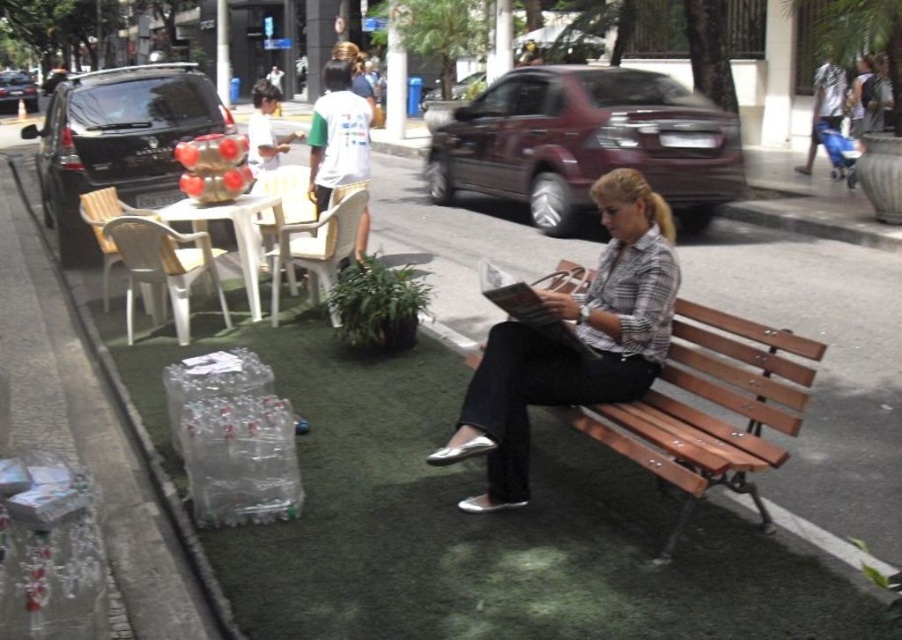
Question: Is plaid fabric shirt at center smaller than wooden bench at center?

Choices:
 (A) no
 (B) yes

Answer: (B)

Question: Is plaid fabric shirt at center above wooden bench at center?

Choices:
 (A) no
 (B) yes

Answer: (B)

Question: Which point appears farthest from the camera in this image?

Choices:
 (A) (661, 243)
 (B) (743, 344)

Answer: (A)

Question: Which point is closer to the camera taking this photo?

Choices:
 (A) (655, 262)
 (B) (802, 392)

Answer: (B)

Question: Is plaid fabric shirt at center above wooden bench at center?

Choices:
 (A) yes
 (B) no

Answer: (A)